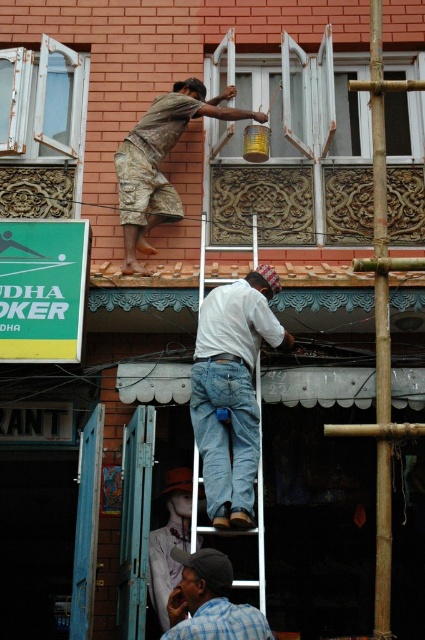
Which is below, white cotton shirt at center or checkered fabric cap at lower center?

Positioned lower is checkered fabric cap at lower center.

From the picture: Which is above, white cotton shirt at center or checkered fabric cap at lower center?

white cotton shirt at center

Does point (198, 451) come behind point (210, 579)?

Yes, it is behind point (210, 579).

Where is `white cotton shirt at center`? white cotton shirt at center is located at coordinates (232, 392).

Can you confirm if white cotton shirt at center is smaller than camouflage shorts at upper center?

Yes, white cotton shirt at center is smaller than camouflage shorts at upper center.

What are the coordinates of `white cotton shirt at center` in the screenshot? It's located at (232, 392).

Find the location of `white cotton shirt at center`. white cotton shirt at center is located at coordinates (232, 392).

Is camouflage shorts at upper center to the left of checkered fabric cap at lower center from the viewer's perspective?

Indeed, camouflage shorts at upper center is positioned on the left side of checkered fabric cap at lower center.

Between point (193, 81) and point (232, 577), which one is positioned behind?

Point (193, 81)

Which is behind, point (166, 122) or point (198, 632)?

The point (166, 122) is more distant.

Find the location of a particular element. camouflage shorts at upper center is located at coordinates (161, 161).